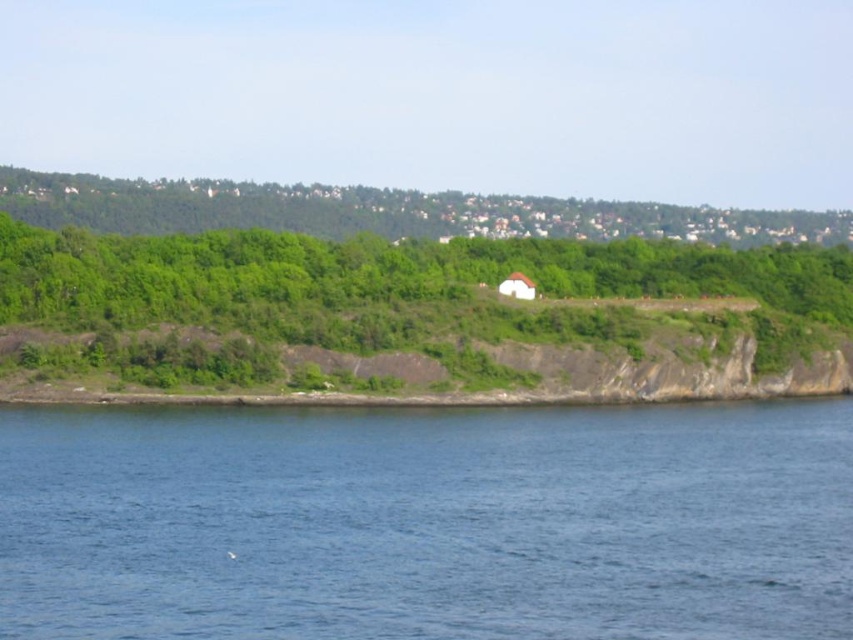
Question: Which point is farther to the camera?

Choices:
 (A) (460, 500)
 (B) (444, 236)

Answer: (B)

Question: Is blue liquid water at lower center closer to camera compared to green leafy trees at upper center?

Choices:
 (A) yes
 (B) no

Answer: (A)

Question: Where is blue liquid water at lower center located in relation to green leafy trees at upper center in the image?

Choices:
 (A) below
 (B) above

Answer: (A)

Question: Which of the following is the closest to the observer?

Choices:
 (A) green leafy trees at upper center
 (B) blue liquid water at lower center

Answer: (B)

Question: Is blue liquid water at lower center to the left of green leafy trees at upper center from the viewer's perspective?

Choices:
 (A) no
 (B) yes

Answer: (A)